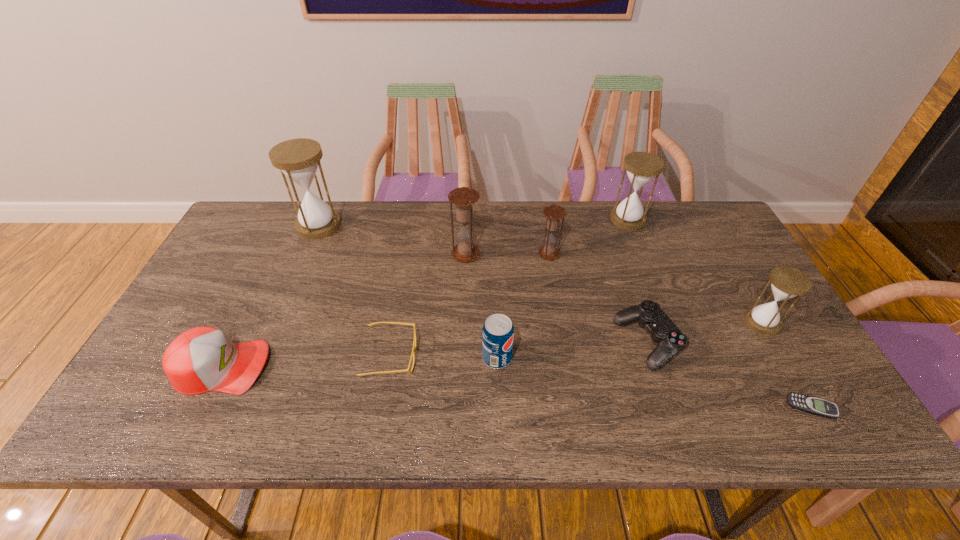
At what (x,y) coordinates should I click in order to perform the action: click on object located at the near edge. Please return your answer as a coordinate pair (x, y). Looking at the image, I should click on (820, 407).

This screenshot has height=540, width=960. Identify the location of object present at the left edge. (202, 359).

The height and width of the screenshot is (540, 960). I want to click on hourglass at the right edge, so click(x=787, y=282).

Find the location of a particular element. beeper situated at the right edge is located at coordinates (820, 407).

Where is `object that is positioned at the near right corner`? The height and width of the screenshot is (540, 960). object that is positioned at the near right corner is located at coordinates (820, 407).

Locate an element on the screen. The height and width of the screenshot is (540, 960). free spot at the far edge of the desktop is located at coordinates (462, 227).

Find the location of a particular element. The height and width of the screenshot is (540, 960). vacant region at the near edge of the desktop is located at coordinates (653, 421).

In the image, there is a desktop. Identify the location of vacant region at the right edge. (756, 388).

Locate an element on the screen. vacant space at the near right corner of the desktop is located at coordinates (771, 427).

The width and height of the screenshot is (960, 540). Identify the location of unoccupied area between the bigger brown hourglass and the black control. (557, 299).